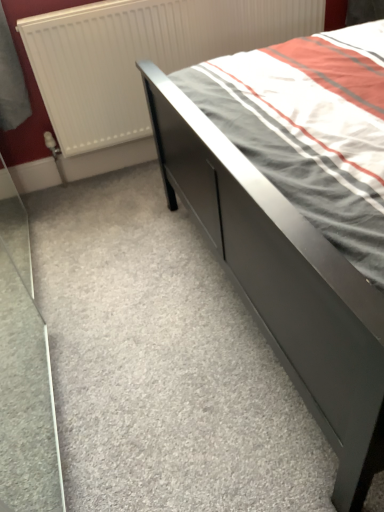
The height and width of the screenshot is (512, 384). What do you see at coordinates (283, 282) in the screenshot?
I see `matte gray bed at center` at bounding box center [283, 282].

Find the location of a particular element. matte gray bed at center is located at coordinates (283, 282).

What is the approximate height of white matte radiator at upper left?

white matte radiator at upper left is 31.51 inches in height.

The image size is (384, 512). Describe the element at coordinates (140, 55) in the screenshot. I see `white matte radiator at upper left` at that location.

This screenshot has width=384, height=512. Identify the location of white matte radiator at upper left. (x=140, y=55).

This screenshot has width=384, height=512. What are the coordinates of `matte gray bed at center` in the screenshot? It's located at (283, 282).

Is white matte radiator at upper left at the left side of matte gray bed at center?

In fact, white matte radiator at upper left is to the right of matte gray bed at center.

Is the depth of white matte radiator at upper left greater than that of matte gray bed at center?

Yes, the depth of white matte radiator at upper left is greater than that of matte gray bed at center.

Is point (99, 16) farther from camera compared to point (194, 165)?

Yes.

From the image's perspective, is white matte radiator at upper left over matte gray bed at center?

Correct, white matte radiator at upper left appears higher than matte gray bed at center in the image.

From a real-world perspective, is white matte radiator at upper left positioned above or below matte gray bed at center?

white matte radiator at upper left is situated higher than matte gray bed at center in the real world.

Is white matte radiator at upper left wider or thinner than matte gray bed at center?

Considering their sizes, white matte radiator at upper left looks slimmer than matte gray bed at center.

In terms of height, does white matte radiator at upper left look taller or shorter compared to matte gray bed at center?

white matte radiator at upper left is taller than matte gray bed at center.

Which of these two, white matte radiator at upper left or matte gray bed at center, is bigger?

matte gray bed at center is bigger.

Which is correct: white matte radiator at upper left is inside matte gray bed at center, or outside of it?

white matte radiator at upper left is located beyond the bounds of matte gray bed at center.

Is white matte radiator at upper left positioned far away from matte gray bed at center?

That's not correct — white matte radiator at upper left is a little close to matte gray bed at center.

Is white matte radiator at upper left aimed at matte gray bed at center?

Yes, white matte radiator at upper left faces towards matte gray bed at center.

How many degrees apart are the facing directions of white matte radiator at upper left and matte gray bed at center?

The angular difference between white matte radiator at upper left and matte gray bed at center is 90.4 degrees.

The image size is (384, 512). What are the coordinates of `radiator behind the matte gray bed at center` in the screenshot? It's located at (140, 55).

Considering the relative positions of matte gray bed at center and white matte radiator at upper left in the image provided, is matte gray bed at center to the right of white matte radiator at upper left from the viewer's perspective?

Incorrect, matte gray bed at center is not on the right side of white matte radiator at upper left.

Who is more distant, matte gray bed at center or white matte radiator at upper left?

white matte radiator at upper left is further away from the camera.

Considering the positions of point (282, 255) and point (122, 3), is point (282, 255) closer or farther from the camera than point (122, 3)?

Point (282, 255) is positioned closer to the camera compared to point (122, 3).

From the image's perspective, is matte gray bed at center over white matte radiator at upper left?

No, from the image's perspective, matte gray bed at center is not on top of white matte radiator at upper left.

From a real-world perspective, which object stands above the other?

white matte radiator at upper left, from a real-world perspective.

Considering the sizes of objects matte gray bed at center and white matte radiator at upper left in the image provided, who is thinner, matte gray bed at center or white matte radiator at upper left?

white matte radiator at upper left.

Is matte gray bed at center taller or shorter than white matte radiator at upper left?

In the image, matte gray bed at center appears to be shorter than white matte radiator at upper left.

Considering the sizes of objects matte gray bed at center and white matte radiator at upper left in the image provided, who is bigger, matte gray bed at center or white matte radiator at upper left?

matte gray bed at center is bigger.

Would you say matte gray bed at center is inside or outside white matte radiator at upper left?

matte gray bed at center exists outside the volume of white matte radiator at upper left.

Consider the image. Is matte gray bed at center next to white matte radiator at upper left and touching it?

No, matte gray bed at center is not next to white matte radiator at upper left.

Is matte gray bed at center turned away from white matte radiator at upper left?

No, matte gray bed at center is not facing away from white matte radiator at upper left.

You are a GUI agent. You are given a task and a screenshot of the screen. Output one action in this format:
    pyautogui.click(x=<x>, y=<y>)
    Task: Click on the bed that is under the white matte radiator at upper left (from a real-world perspective)
    
    Given the screenshot: What is the action you would take?
    pyautogui.click(x=283, y=282)

This screenshot has width=384, height=512. I want to click on bed lying in front of the white matte radiator at upper left, so click(283, 282).

Where is `bed lying below the white matte radiator at upper left (from the image's perspective)`? bed lying below the white matte radiator at upper left (from the image's perspective) is located at coordinates (283, 282).